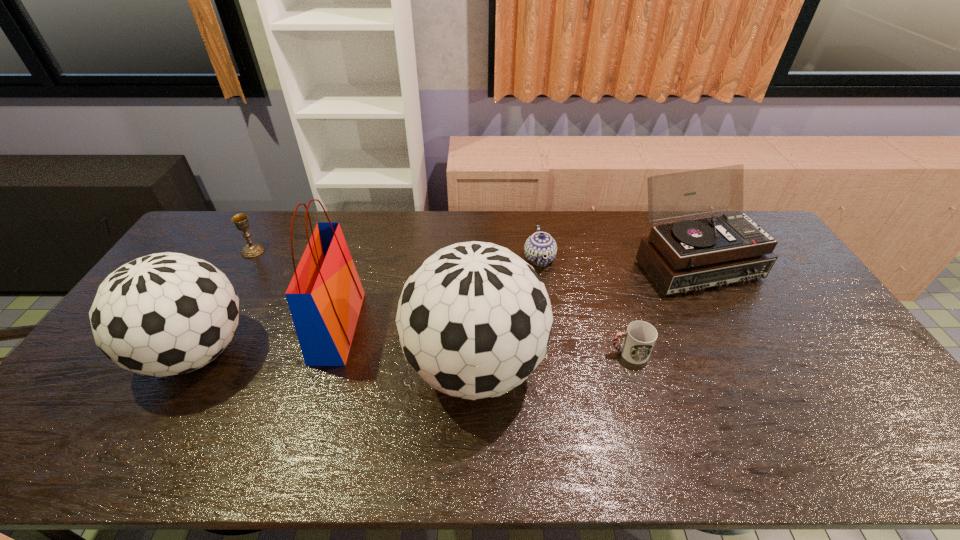
You are a GUI agent. You are given a task and a screenshot of the screen. Output one action in this format:
    pyautogui.click(x=<x>, y=<y>)
    Task: Click on the left soccer ball
    This screenshot has width=960, height=540.
    Given the screenshot: What is the action you would take?
    pyautogui.click(x=164, y=314)

At what (x,y) coordinates should I click in order to perform the action: click on the right soccer ball. Please return your answer as a coordinate pair (x, y). This screenshot has height=540, width=960. Looking at the image, I should click on (474, 320).

You are a GUI agent. You are given a task and a screenshot of the screen. Output one action in this format:
    pyautogui.click(x=<x>, y=<y>)
    Task: Click on the record player
    
    Given the screenshot: What is the action you would take?
    pyautogui.click(x=689, y=255)

In order to click on chinaware in this screenshot , I will do `click(539, 245)`.

Find the location of a particular element. The image size is (960, 540). the third object from left to right is located at coordinates (325, 295).

Where is `the fifth tallest object`? This screenshot has width=960, height=540. the fifth tallest object is located at coordinates (241, 221).

Locate an element on the screen. cup is located at coordinates (639, 338).

Locate an element on the screen. This screenshot has width=960, height=540. the shortest object is located at coordinates (639, 338).

Where is `vacant region located 0.230m on the back of the left soccer ball`? vacant region located 0.230m on the back of the left soccer ball is located at coordinates (250, 261).

Image resolution: width=960 pixels, height=540 pixels. I want to click on blank area located 0.270m on the left of the right soccer ball, so click(306, 366).